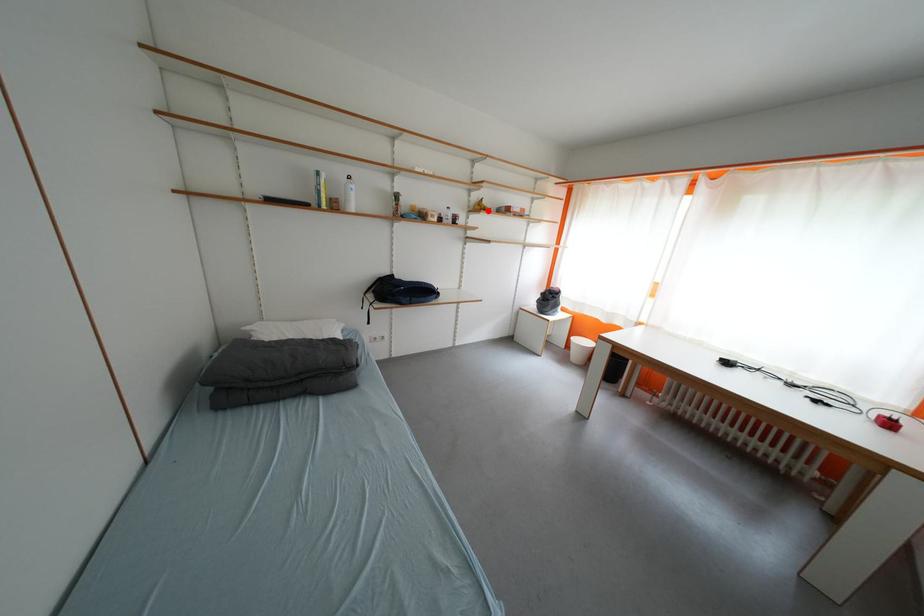
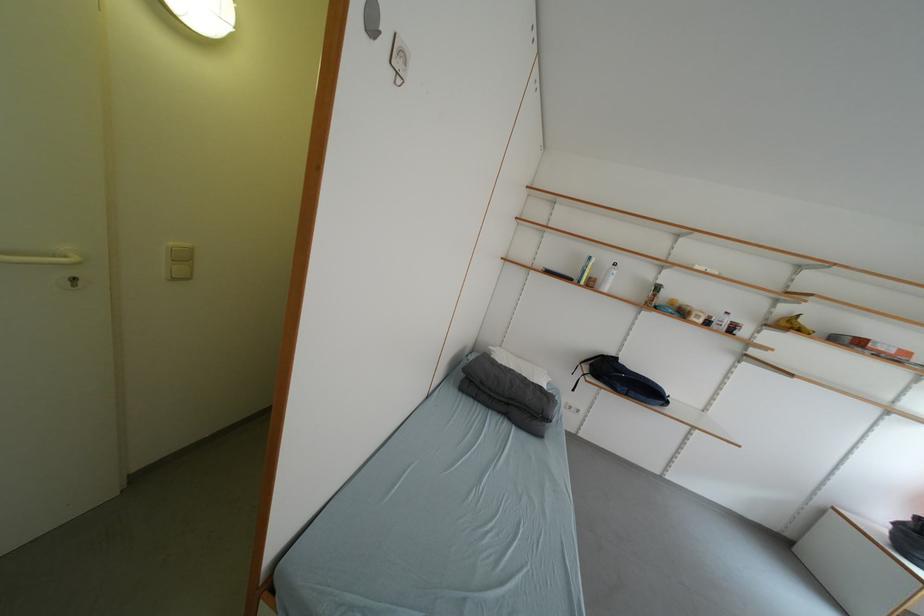
Locate, in the second image, the point that corresponds to the highlighted location in the first image.

(797, 328)